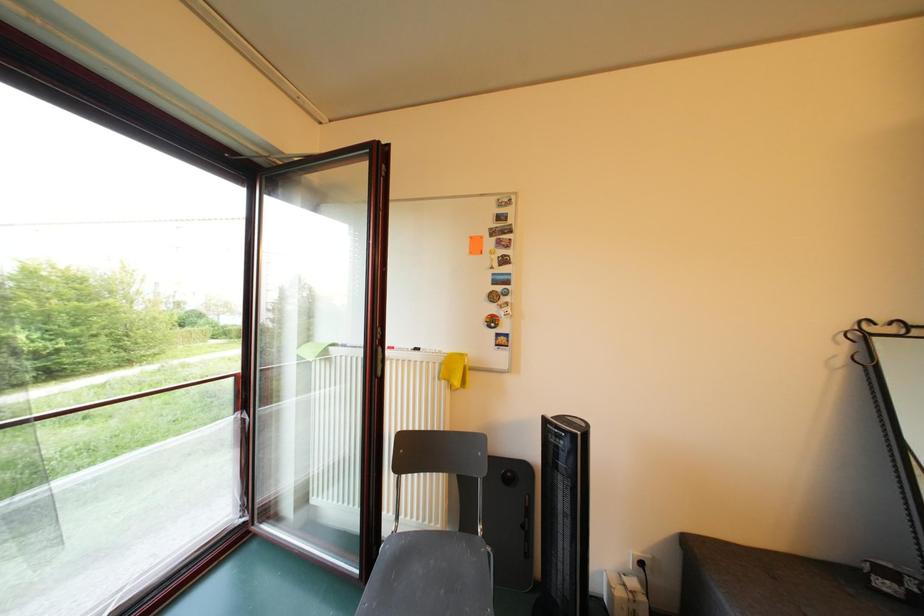
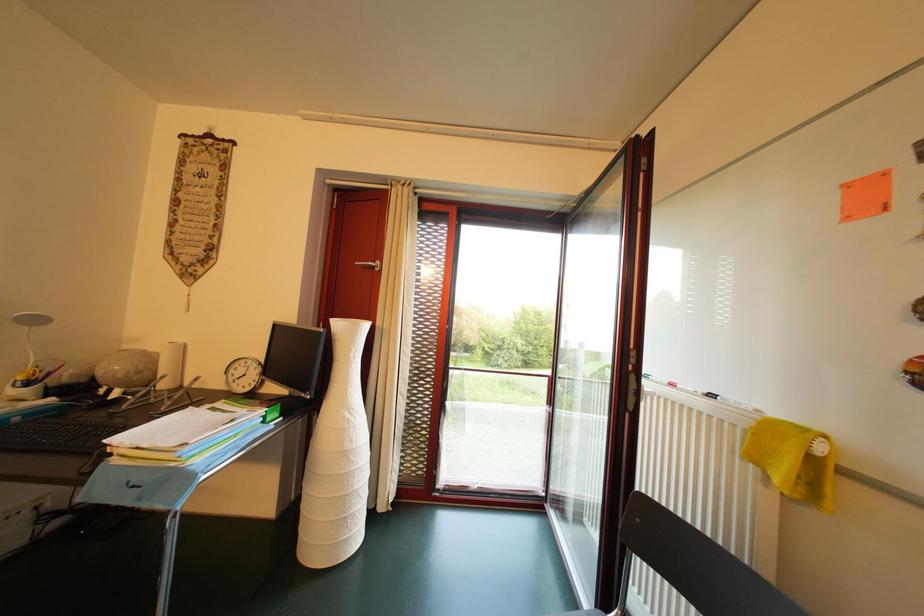
Question: Based on the continuous images, in which direction is the camera rotating? Reply with the corresponding letter.

Choices:
 (A) Left
 (B) Right
 (C) Up
 (D) Down

Answer: (A)